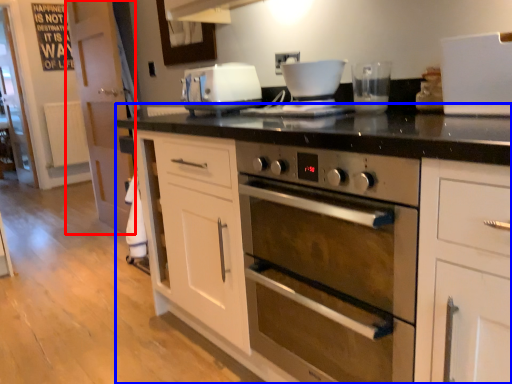
Question: Which object is closer to the camera taking this photo, glass door (highlighted by a red box) or cabinetry (highlighted by a blue box)?

Choices:
 (A) glass door
 (B) cabinetry

Answer: (B)